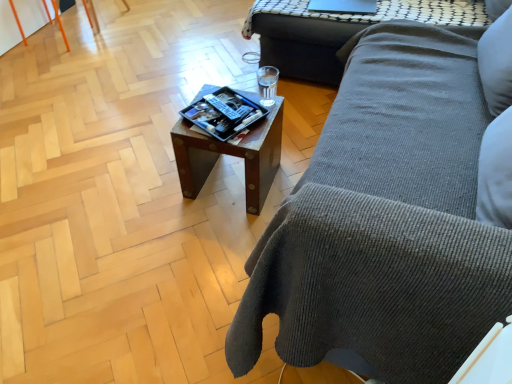
The width and height of the screenshot is (512, 384). What are the coordinates of `free space to the right of orange plastic chair at upper left` in the screenshot? It's located at (109, 43).